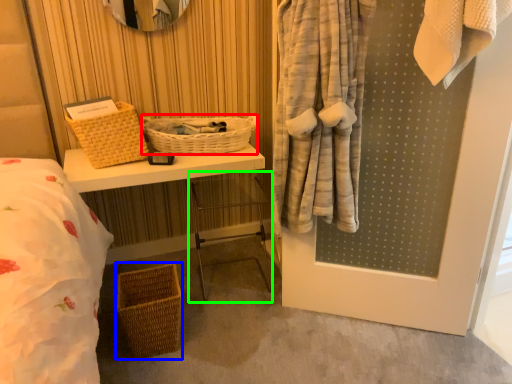
Question: Considering the real-world distances, which object is closest to basket (highlighted by a red box)? basket (highlighted by a blue box) or chair (highlighted by a green box).

Choices:
 (A) basket
 (B) chair

Answer: (B)